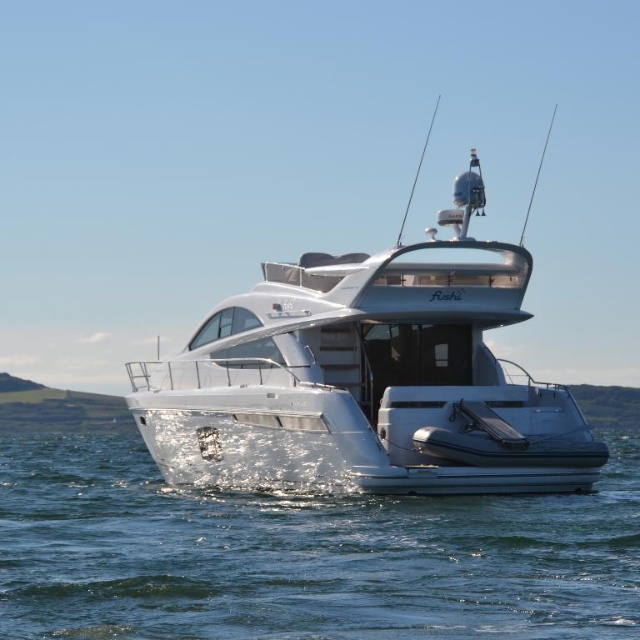
You are a passenger on the Fushi yacht and want to jump into the water. Which object must you pass by to reach the clear water at lower center from the silver metallic boat at center?

To reach the clear water at lower center from the silver metallic boat at center, you must pass by the silver metallic boat at center since the clear water at lower center is located below it.